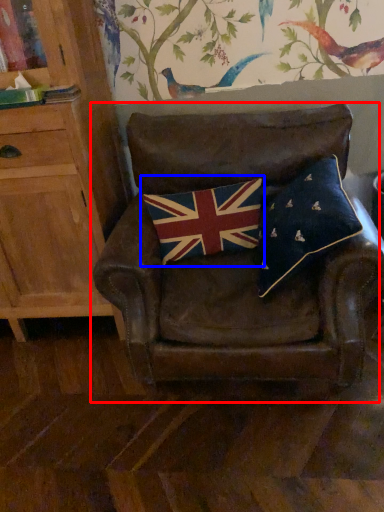
Question: Which object is closer to the camera taking this photo, chair (highlighted by a red box) or flag (highlighted by a blue box)?

Choices:
 (A) chair
 (B) flag

Answer: (A)